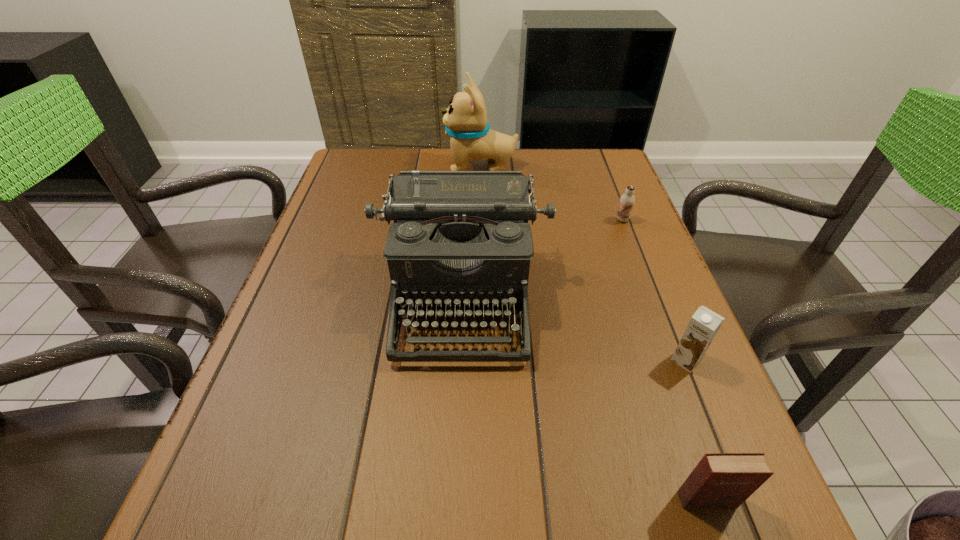
Where is `the farthest object`? The height and width of the screenshot is (540, 960). the farthest object is located at coordinates (465, 119).

Where is `the second tallest object`? the second tallest object is located at coordinates (459, 237).

Where is `the nearer chocolate milk`? the nearer chocolate milk is located at coordinates (x=703, y=326).

The width and height of the screenshot is (960, 540). Identify the location of the nearest object. (720, 480).

The width and height of the screenshot is (960, 540). Find the location of `the farther chocolate milk`. the farther chocolate milk is located at coordinates (627, 200).

Where is `the fourth nearest object`? The width and height of the screenshot is (960, 540). the fourth nearest object is located at coordinates (627, 200).

Identify the location of vacant space situated on the face of the puppy. The image size is (960, 540). (345, 166).

Locate an element on the screen. blank space located on the face of the puppy is located at coordinates (371, 166).

Find the location of a particular element. Image resolution: width=960 pixels, height=540 pixels. free region located on the face of the puppy is located at coordinates (380, 166).

Image resolution: width=960 pixels, height=540 pixels. What are the coordinates of `blank space located 0.170m on the typing side of the fourth shortest object` in the screenshot? It's located at (455, 456).